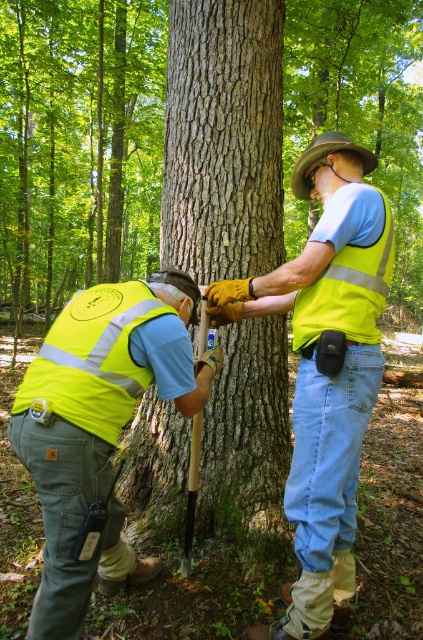
You are a park ranger assessing the safety of the area. You notice the smooth bark tree trunk at center and the brown fabric cowboy hat at upper center. Which object would require more space to safely remove from the area?

The smooth bark tree trunk at center is larger in size than the brown fabric cowboy hat at upper center, so it would require more space to safely remove from the area.

You are a park ranger who needs to mark a tree for a survey. You have a GPS device showing coordinates. Where should you go to find the smooth bark tree trunk at center?

The smooth bark tree trunk at center is located at coordinates point (222, 138).